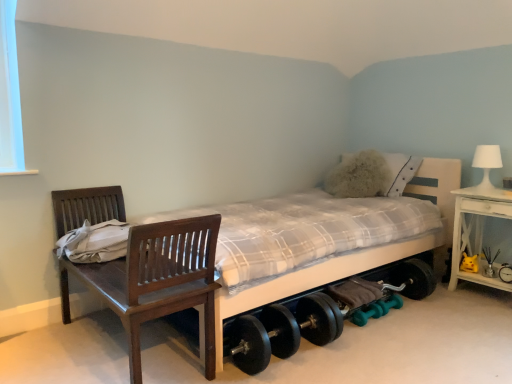
Locate an element on the screen. The image size is (512, 384). free space in front of teal rubber dumbbell at lower center, the 1th dumbbell viewed from the left is located at coordinates (373, 336).